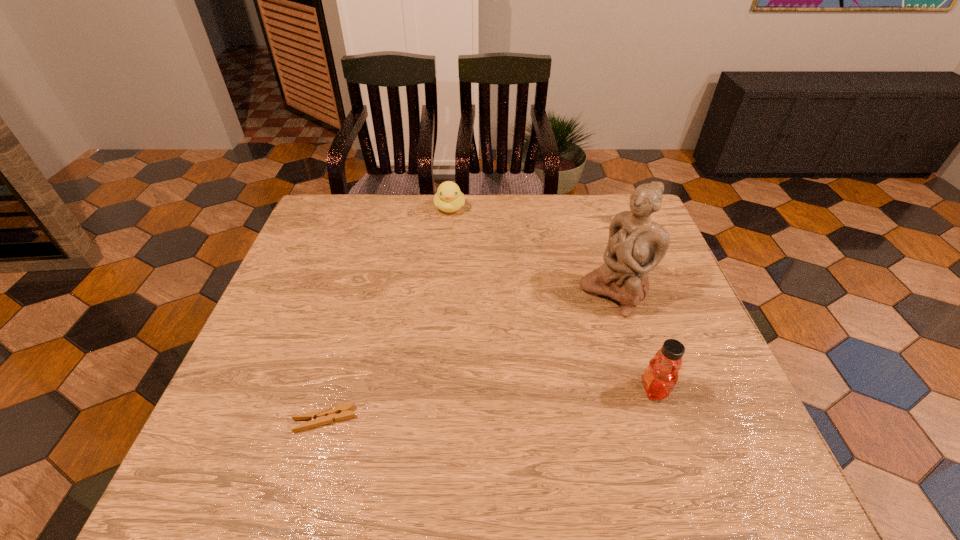
The image size is (960, 540). I want to click on honey that is at the near edge, so 661,375.

The image size is (960, 540). In order to click on object that is at the left edge in this screenshot , I will do `click(317, 418)`.

Where is `honey at the right edge`? The width and height of the screenshot is (960, 540). honey at the right edge is located at coordinates (661, 375).

At what (x,y) coordinates should I click in order to perform the action: click on figurine at the right edge. Please return your answer as a coordinate pair (x, y). Looking at the image, I should click on (636, 244).

What are the coordinates of `object that is at the near left corner` in the screenshot? It's located at (317, 418).

Where is `object situated at the near right corner`? The width and height of the screenshot is (960, 540). object situated at the near right corner is located at coordinates (661, 375).

You are a GUI agent. You are given a task and a screenshot of the screen. Output one action in this format:
    pyautogui.click(x=<x>, y=<y>)
    Task: Click on the vacant area at the far edge
    This screenshot has width=960, height=540.
    Given the screenshot: What is the action you would take?
    pyautogui.click(x=423, y=235)

The image size is (960, 540). Identify the location of free region at the near edge of the desktop. (409, 422).

Locate an element on the screen. This screenshot has height=540, width=960. free location at the left edge is located at coordinates (310, 319).

Where is `vacant position at the right edge of the desktop`? vacant position at the right edge of the desktop is located at coordinates (679, 339).